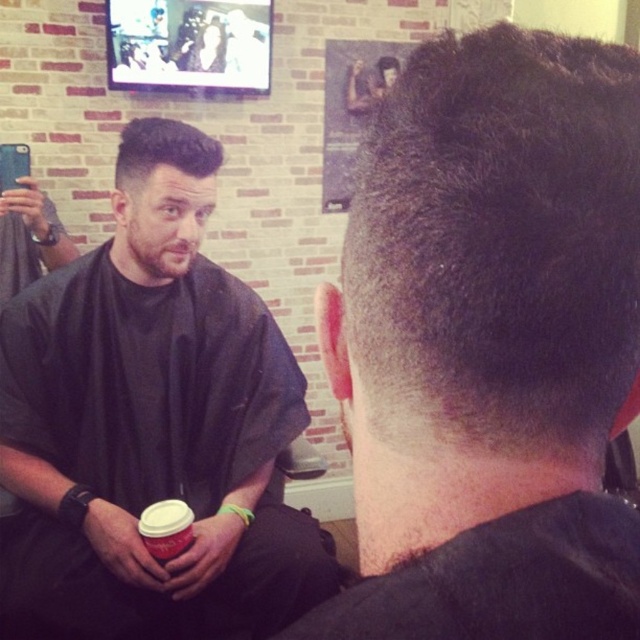
Question: Where is dark brown hair at center located in relation to matte black hair at upper left in the image?

Choices:
 (A) below
 (B) above

Answer: (B)

Question: Which object appears farthest from the camera in this image?

Choices:
 (A) matte black hair at upper left
 (B) dark brown hair at center
 (C) sleek dark hair at upper left

Answer: (C)

Question: Among these objects, which one is farthest from the camera?

Choices:
 (A) matte black hair at upper left
 (B) dark brown hair at center
 (C) sleek dark hair at upper left

Answer: (C)

Question: Can you confirm if matte black hair at upper left is bigger than sleek dark hair at upper left?

Choices:
 (A) yes
 (B) no

Answer: (A)

Question: Which point is farther from the camera taking this photo?

Choices:
 (A) [x=140, y=179]
 (B) [x=442, y=189]

Answer: (A)

Question: Can you confirm if dark brown hair at center is bigger than sleek dark hair at upper left?

Choices:
 (A) no
 (B) yes

Answer: (B)